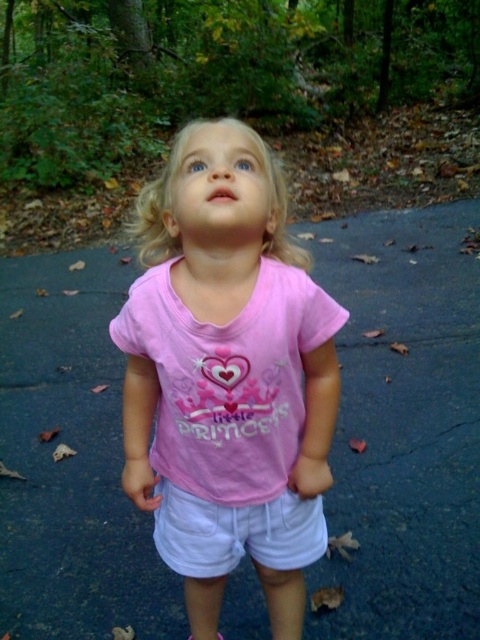
Is point (193, 512) positioned behind point (220, 637)?

No, (193, 512) is closer to viewer.

Looking at this image, between white cotton shorts at center and pink fabric sandal at lower center, which one has less height?

pink fabric sandal at lower center is shorter.

Locate an element on the screen. This screenshot has height=640, width=480. white cotton shorts at center is located at coordinates (236, 532).

Where is `white cotton shorts at center`? Image resolution: width=480 pixels, height=640 pixels. white cotton shorts at center is located at coordinates (236, 532).

Who is taller, pink fabric shirt at center or white cotton shorts at center?

pink fabric shirt at center is taller.

Locate an element on the screen. This screenshot has height=640, width=480. pink fabric shirt at center is located at coordinates (225, 333).

Who is lower down, matte asphalt pavement at center or pink fabric sandal at lower center?

pink fabric sandal at lower center is below.

This screenshot has height=640, width=480. I want to click on matte asphalt pavement at center, so click(x=404, y=426).